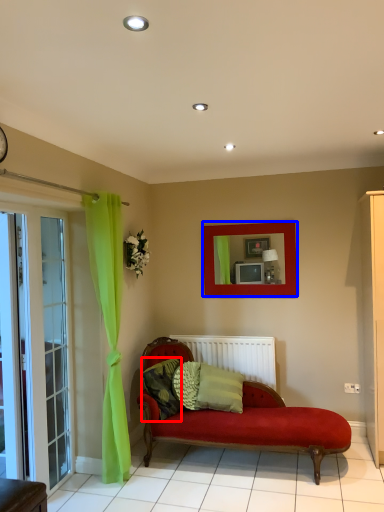
Question: Which point is further to the camera, pillow (highlighted by a red box) or picture frame (highlighted by a blue box)?

Choices:
 (A) pillow
 (B) picture frame

Answer: (B)